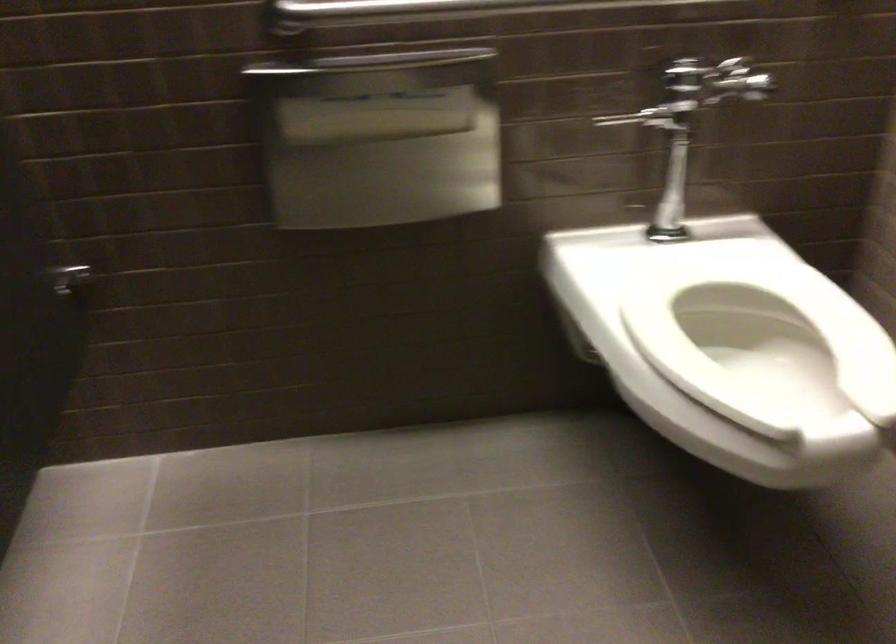
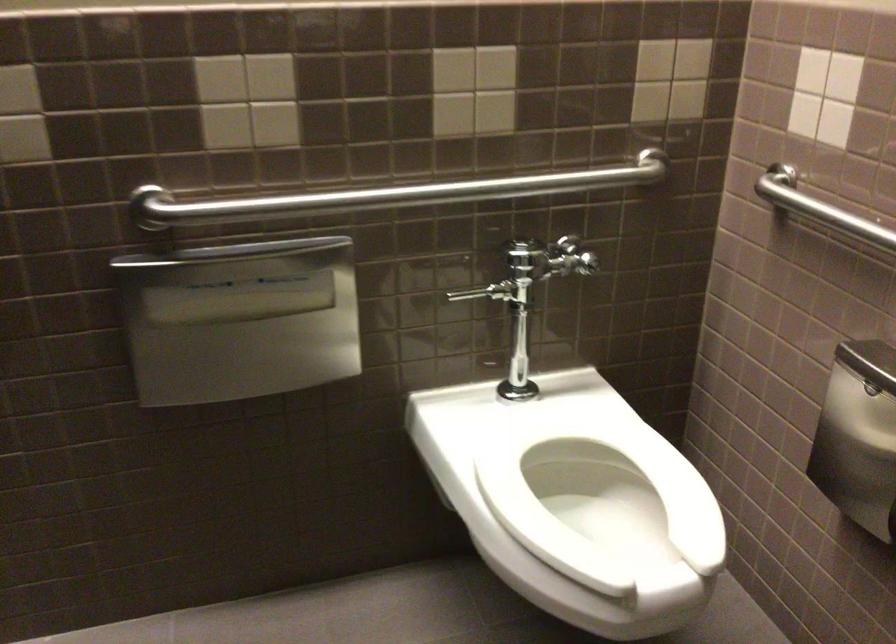
Question: The camera is either moving clockwise (left) or counter-clockwise (right) around the object. The first image is from the beginning of the video and the second image is from the end. Is the camera moving left or right when shooting the video?

Choices:
 (A) Left
 (B) Right

Answer: (A)